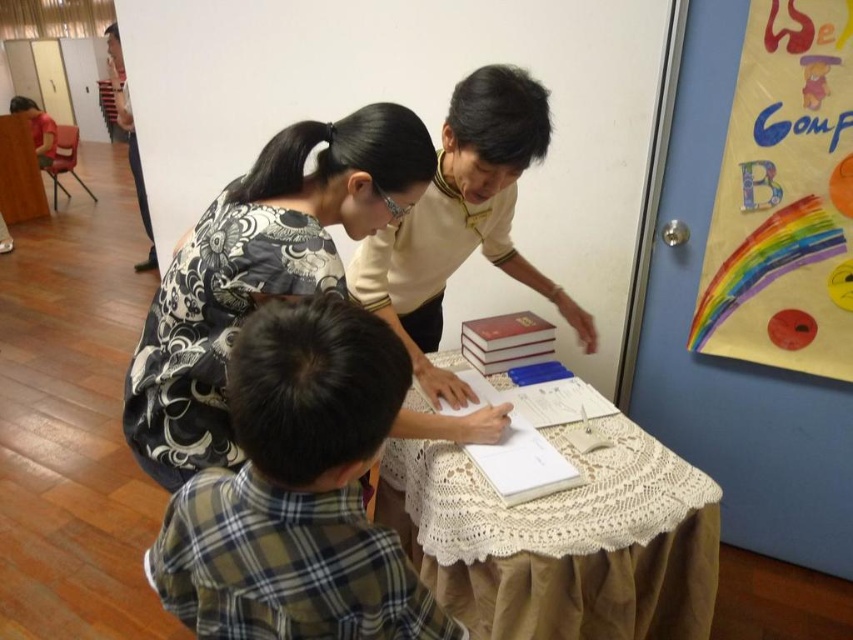
You are a student trying to reach the hardcover book at center on the table without moving the patterned fabric blouse at center. Is this possible given their sizes?

The patterned fabric blouse at center is larger in size than the hardcover book at center, so there might not be enough space to reach the book without moving the blouse.

You are a student trying to reach the white lace tablecloth at center to grab a pen. The matte black shirt at upper left is in your way. Can you move the shirt to access the tablecloth?

The white lace tablecloth at center is shorter than the matte black shirt at upper left, meaning the shirt is closer to you. You can move the matte black shirt at upper left out of the way to access the white lace tablecloth at center.